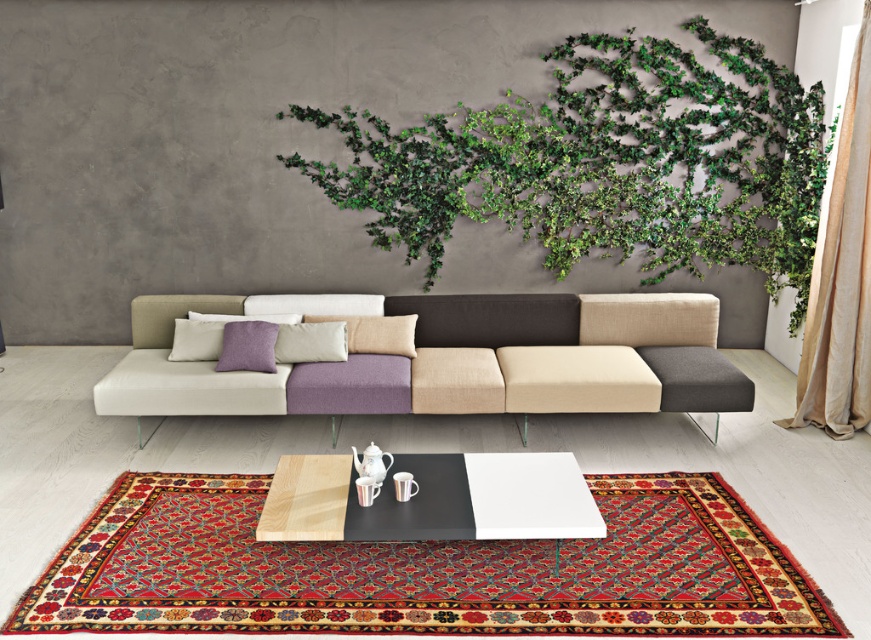
You are an interior designer assessing the living room layout. You need to determine if the green leafy wall art at upper center and the textured fabric couch at center are appropriately scaled relative to each other. Based on their sizes, which object is larger?

The green leafy wall art at upper center is larger than the textured fabric couch at center, so they are appropriately scaled as the wall art draws attention as the focal point.